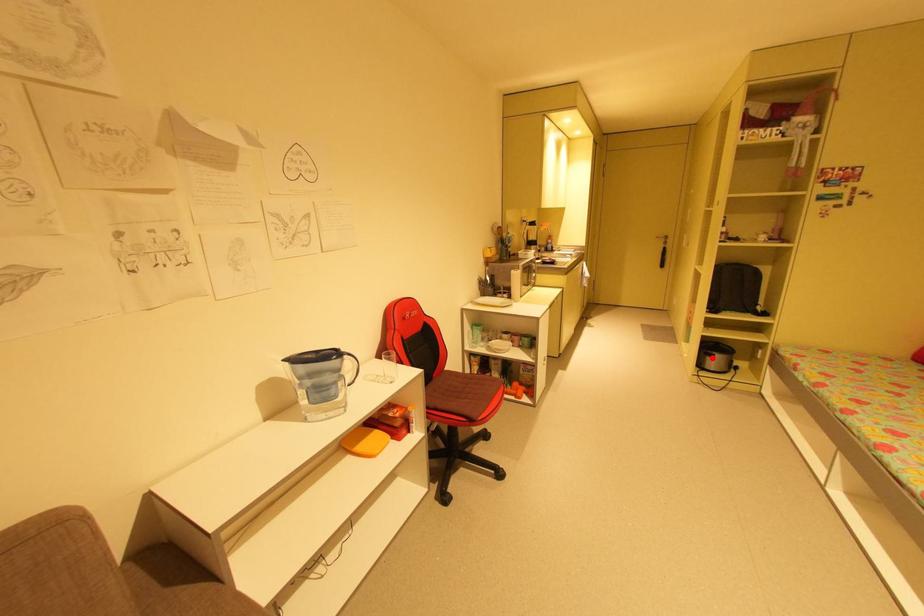
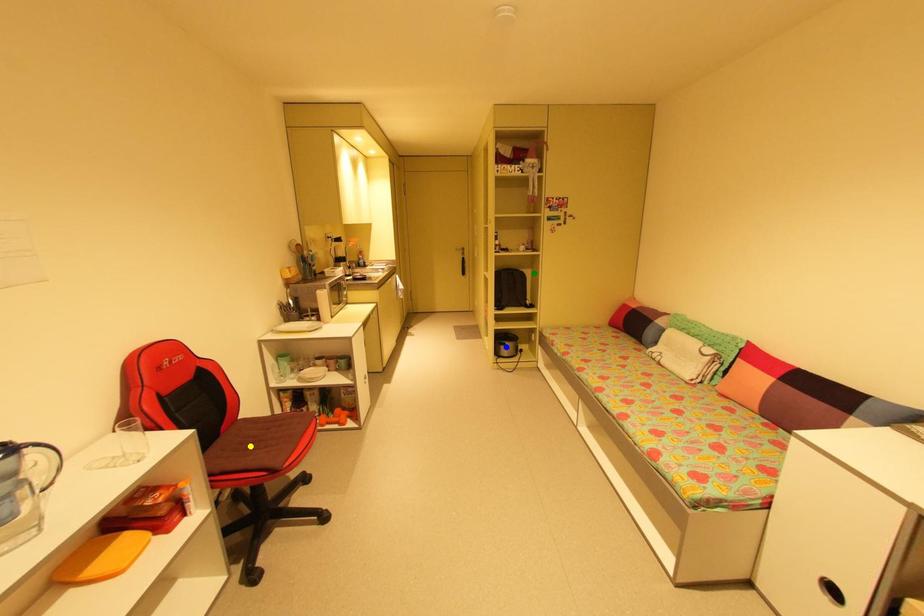
Question: I am providing you with two images of the same scene from different viewpoints. A red point is marked on the first image. You are given multiple points on the second image. Which mark in image 2 goes with the point in image 1?

Choices:
 (A) green point
 (B) blue point
 (C) yellow point

Answer: (B)